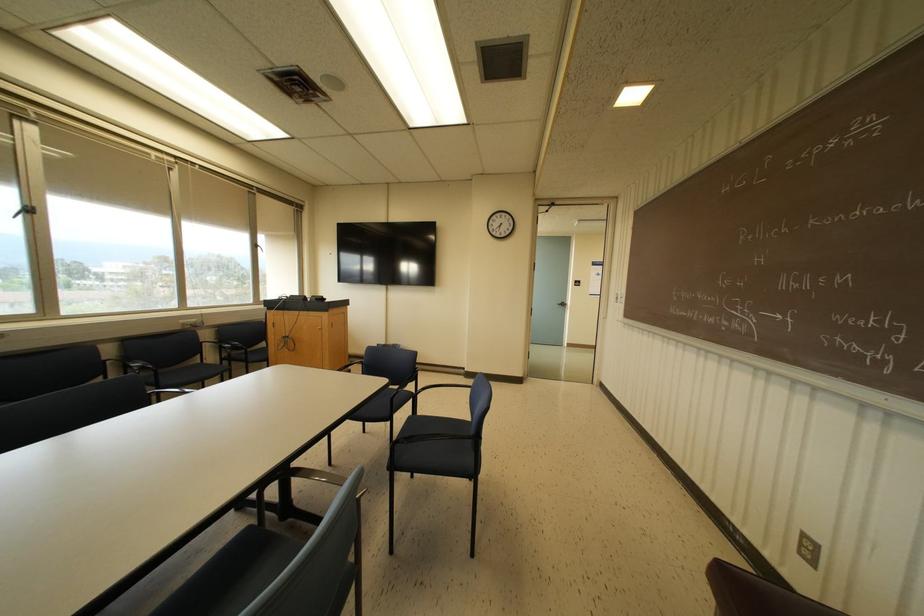
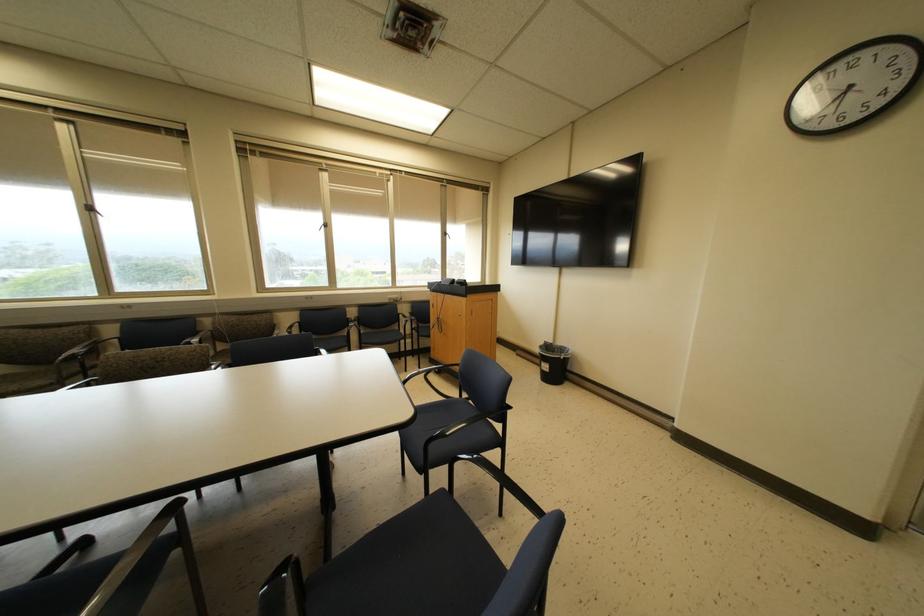
Locate, in the second image, the point that corresponds to pixel 394 346 in the first image.

(562, 349)